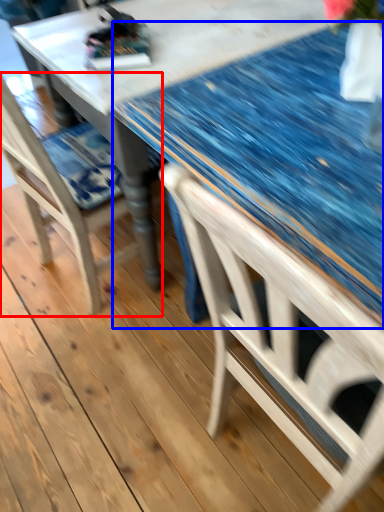
Question: Which point is further to the camera, chair (highlighted by a red box) or glass table (highlighted by a blue box)?

Choices:
 (A) chair
 (B) glass table

Answer: (B)